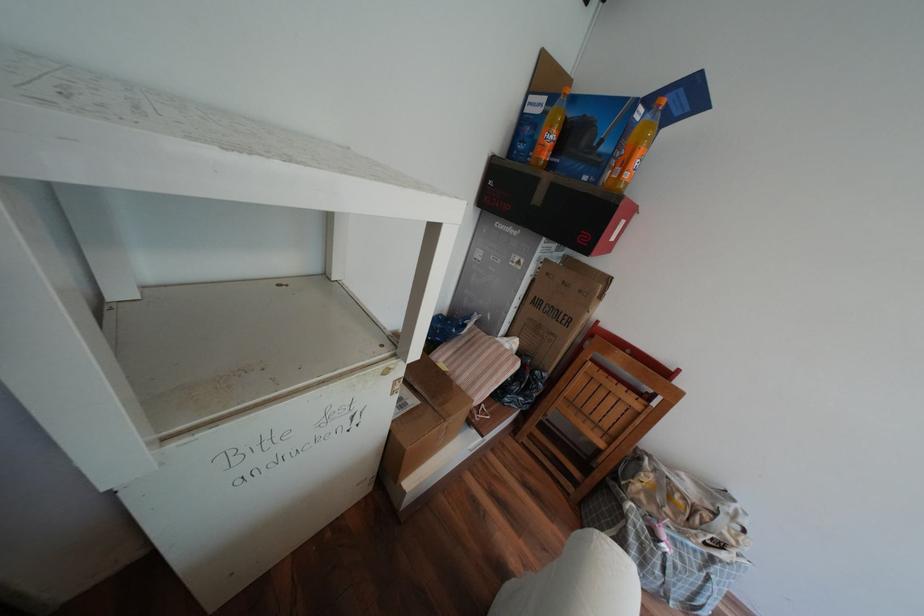
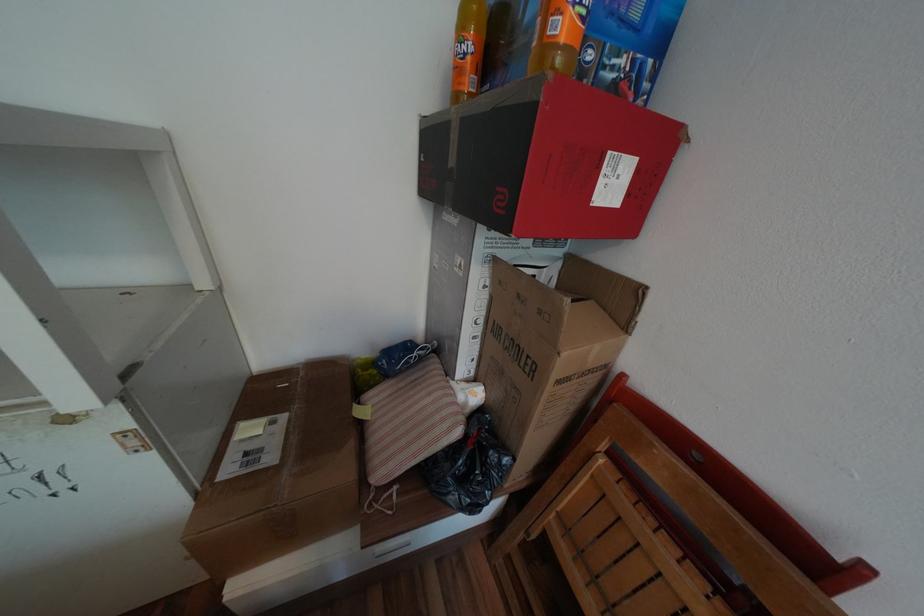
The point at (590, 291) is marked in the first image. Where is the corresponding point in the second image?

(550, 312)